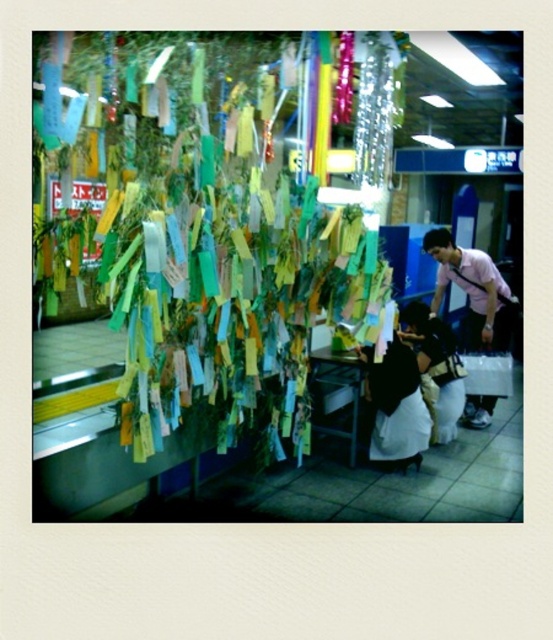
Measure the distance between paper tags at left and black satin skirt at lower center.

39.30 inches

Which is more to the right, paper tags at left or black satin skirt at lower center?

black satin skirt at lower center

Between point (272, 273) and point (399, 401), which one is positioned behind?

Positioned behind is point (399, 401).

At what (x,y) coordinates should I click in order to perform the action: click on paper tags at left. Please return your answer as a coordinate pair (x, y). Looking at the image, I should click on (196, 310).

Looking at this image, between black satin skirt at lower center and black fabric bag at center, which one has less height?

With less height is black satin skirt at lower center.

Between black satin skirt at lower center and black fabric bag at center, which one is positioned lower?

black satin skirt at lower center is below.

What do you see at coordinates (395, 404) in the screenshot?
I see `black satin skirt at lower center` at bounding box center [395, 404].

The height and width of the screenshot is (640, 553). What are the coordinates of `black satin skirt at lower center` in the screenshot? It's located at (395, 404).

Locate an element on the screen. This screenshot has width=553, height=640. paper tags at left is located at coordinates (196, 310).

Is point (101, 410) behind point (440, 420)?

No.

Between point (298, 220) and point (420, 332), which one is positioned behind?

The point (420, 332) is behind.

Locate an element on the screen. This screenshot has height=640, width=553. paper tags at left is located at coordinates (196, 310).